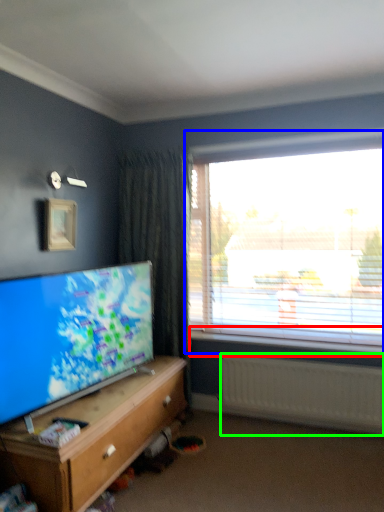
Question: Which object is the closest to the window sill (highlighted by a red box)? Choose among these: window (highlighted by a blue box) or radiator (highlighted by a green box).

Choices:
 (A) window
 (B) radiator

Answer: (B)